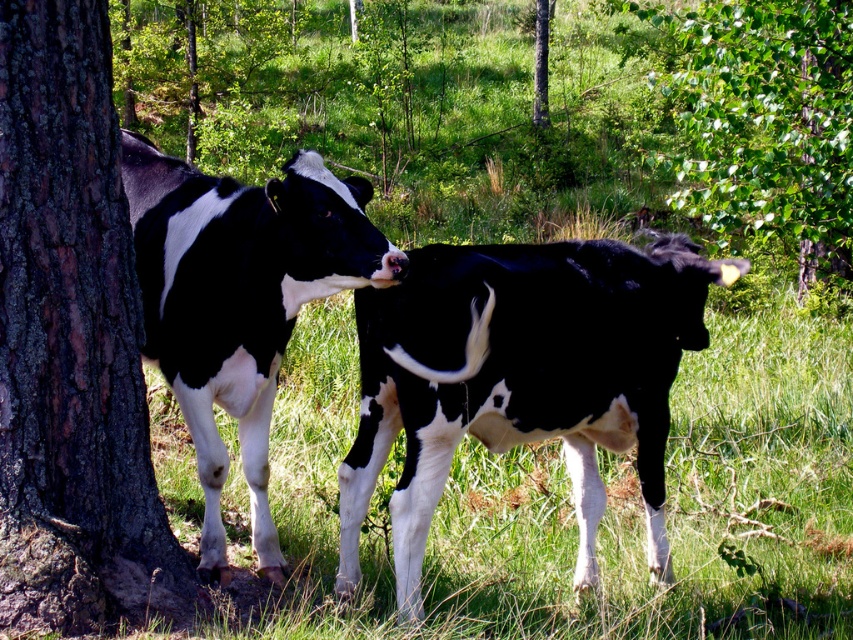
Can you confirm if brown rough tree trunk at left is shorter than black and white spotted cow at left?

Incorrect, brown rough tree trunk at left's height does not fall short of black and white spotted cow at left's.

Is brown rough tree trunk at left to the right of black and white spotted cow at left from the viewer's perspective?

In fact, brown rough tree trunk at left is to the left of black and white spotted cow at left.

Between point (115, 474) and point (350, 285), which one is positioned in front?

Point (115, 474) is more forward.

Identify the location of brown rough tree trunk at left. pyautogui.click(x=71, y=342).

Who is more forward, (576, 461) or (332, 188)?

Point (332, 188)

Does black and white fur at center appear under black and white spotted cow at left?

Correct, black and white fur at center is located below black and white spotted cow at left.

Identify the location of black and white fur at center. Image resolution: width=853 pixels, height=640 pixels. (521, 376).

Does brown rough tree trunk at left have a lesser width compared to green leafy tree at upper right?

In fact, brown rough tree trunk at left might be wider than green leafy tree at upper right.

From the picture: Can you confirm if brown rough tree trunk at left is positioned to the left of green leafy tree at upper right?

Yes, brown rough tree trunk at left is to the left of green leafy tree at upper right.

Between point (126, 305) and point (741, 109), which one is positioned behind?

Point (741, 109)

Find the location of `brown rough tree trunk at left`. brown rough tree trunk at left is located at coordinates (71, 342).